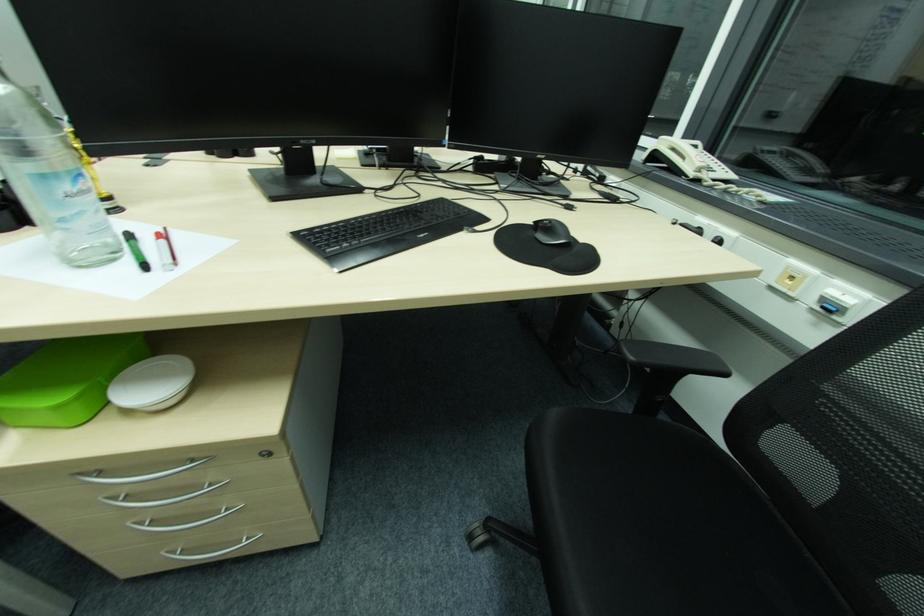
Describe the element at coordinates (684, 151) in the screenshot. The image size is (924, 616). I see `the white telephone handset` at that location.